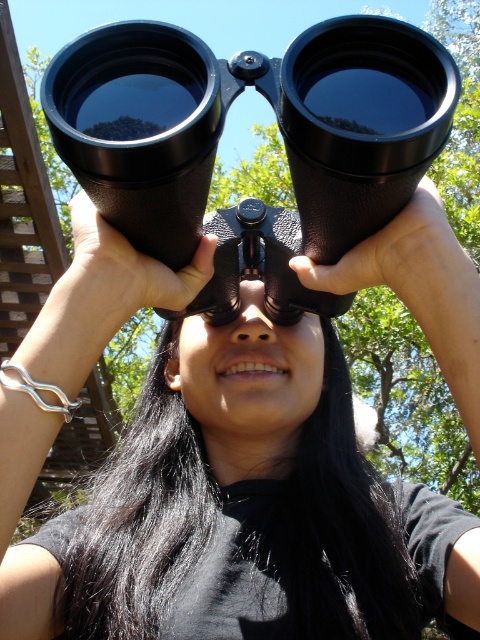
Question: Which point is farther to the camera?

Choices:
 (A) black matte binoculars at center
 (B) black rubber binoculars at center

Answer: (A)

Question: Among these objects, which one is farthest from the camera?

Choices:
 (A) black matte binoculars at center
 (B) black rubber binoculars at center

Answer: (A)

Question: Can you confirm if black matte binoculars at center is bigger than black rubber binoculars at center?

Choices:
 (A) no
 (B) yes

Answer: (B)

Question: Can you confirm if black matte binoculars at center is positioned to the left of black rubber binoculars at center?

Choices:
 (A) yes
 (B) no

Answer: (A)

Question: Where is black matte binoculars at center located in relation to black rubber binoculars at center in the image?

Choices:
 (A) above
 (B) below

Answer: (B)